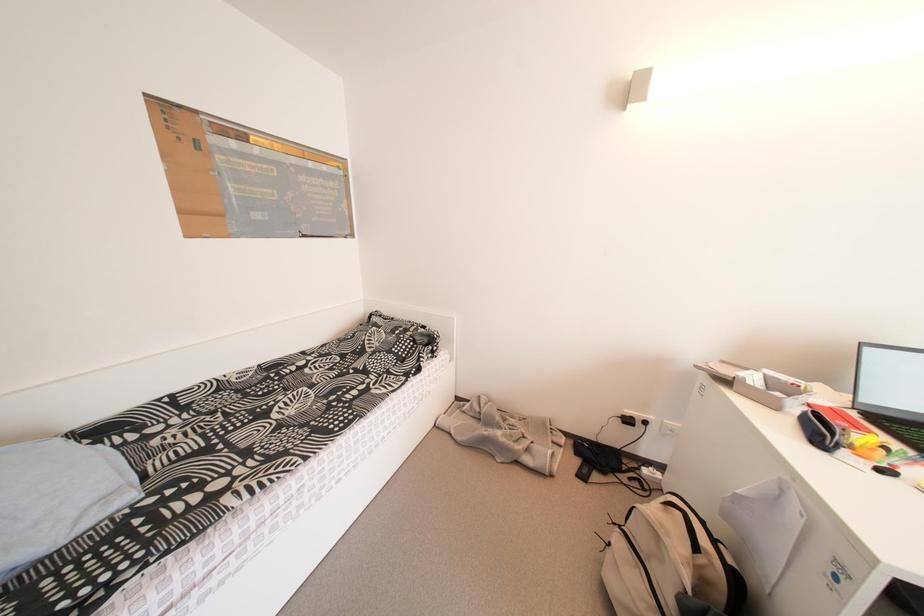
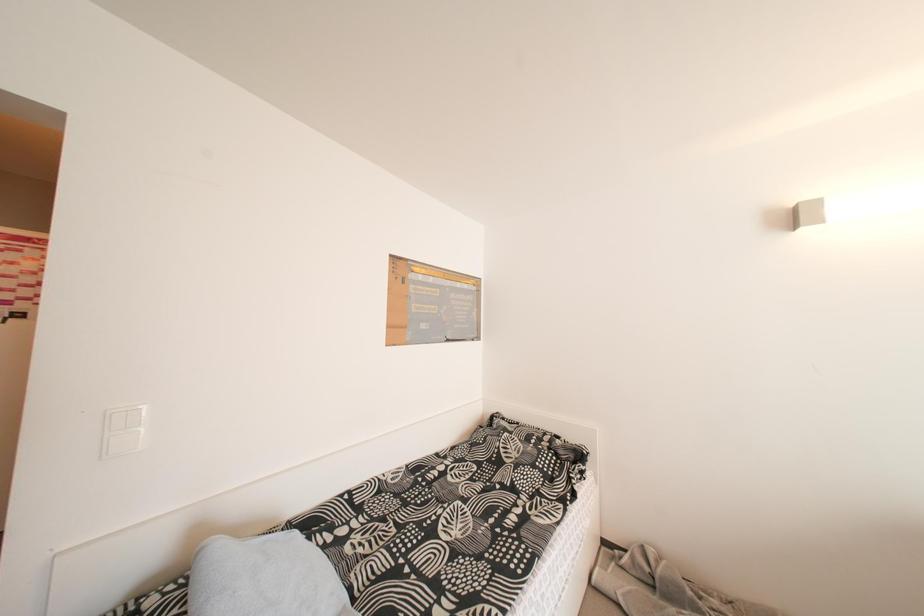
Question: Which direction would the cameraman need to move to produce the second image? Reply with the corresponding letter.

Choices:
 (A) Left
 (B) Right
 (C) Forward
 (D) Backward

Answer: (A)